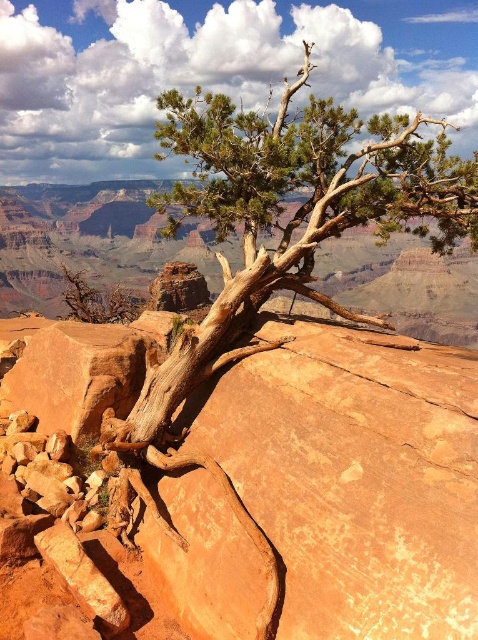
From the picture: Is the position of orange rough rock at center less distant than that of brown rough bark tree at center?

Yes, it is in front of brown rough bark tree at center.

Between orange rough rock at center and brown rough bark tree at center, which one appears on the left side from the viewer's perspective?

Positioned to the left is orange rough rock at center.

Does point (31, 417) lie in front of point (139, 420)?

No, it is not.

Where is `orange rough rock at center`? The image size is (478, 640). orange rough rock at center is located at coordinates (281, 499).